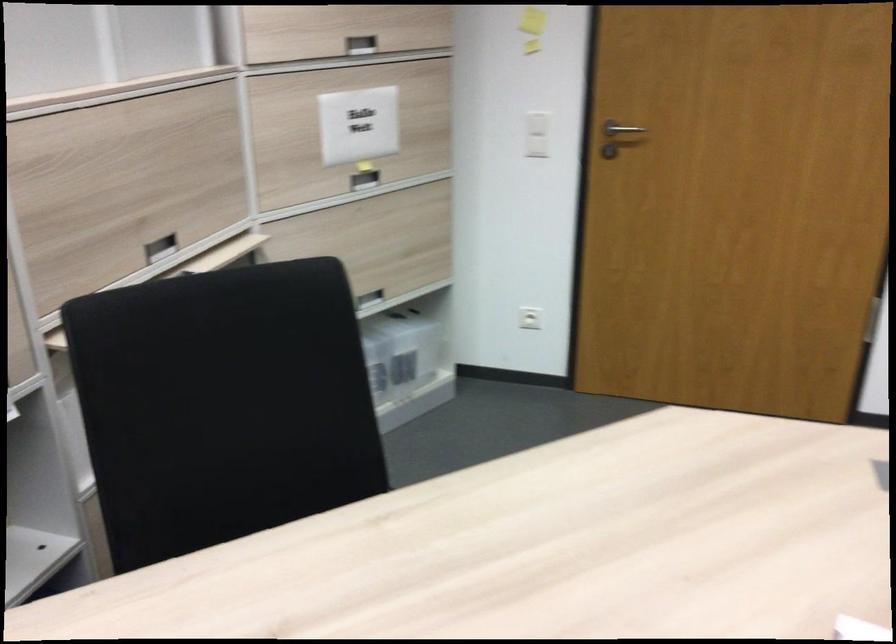
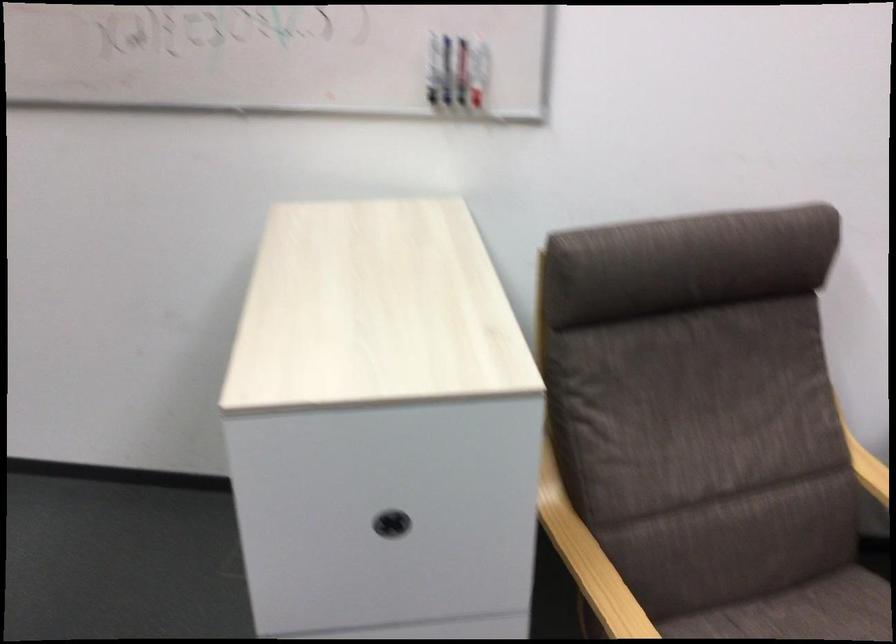
The images are taken continuously from a first-person perspective. In which direction is your viewpoint rotating?

The rotation direction of the camera is right-down.